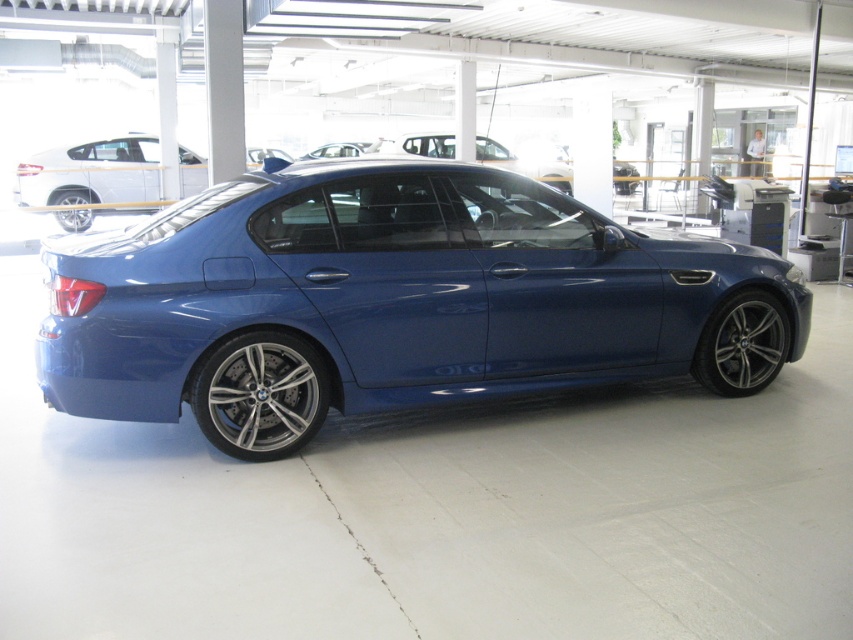
From the picture: Who is taller, glossy metallic car at center or matte black wheel at rear left?

Standing taller between the two is glossy metallic car at center.

Is point (96, 240) less distant than point (74, 202)?

Yes, it is.

Identify the location of glossy metallic car at center. Image resolution: width=853 pixels, height=640 pixels. (374, 300).

Does point (165, 326) come behind point (270, 365)?

No, it is in front of (270, 365).

Can you confirm if glossy metallic car at center is positioned below polished aluminum wheel at lower center?

No.

Between point (642, 342) and point (204, 401), which one is positioned behind?

The point (642, 342) is more distant.

Where is `glossy metallic car at center`? This screenshot has height=640, width=853. glossy metallic car at center is located at coordinates (374, 300).

Is glossy metallic car at center positioned at the back of polished silver wheel at lower right?

That is False.

Between glossy metallic car at center and polished silver wheel at lower right, which one appears on the left side from the viewer's perspective?

glossy metallic car at center

Who is more forward, (36, 349) or (701, 376)?

Point (36, 349) is in front.

I want to click on glossy metallic car at center, so click(374, 300).